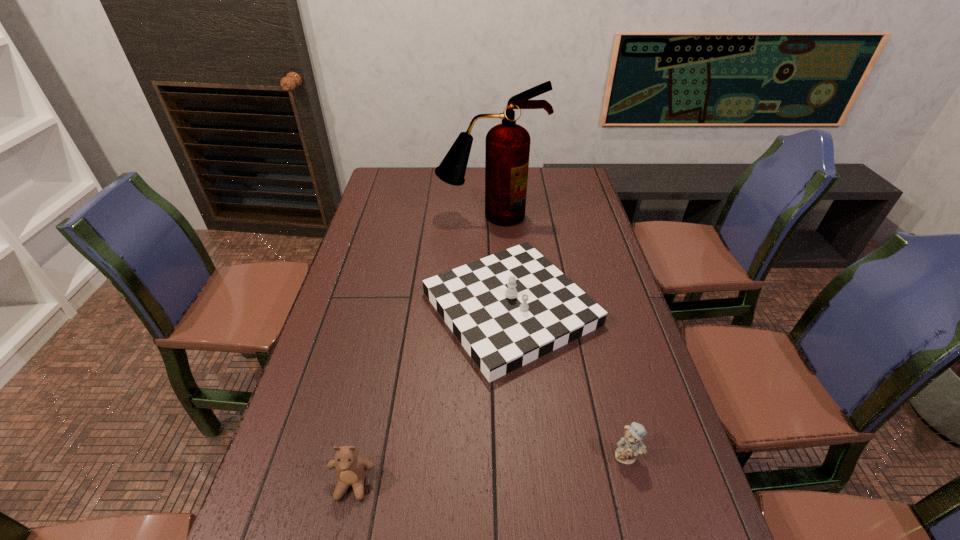
In order to click on the farthest object in this screenshot , I will do `click(507, 149)`.

Identify the location of the tallest object. (507, 149).

I want to click on checkerboard, so click(x=508, y=309).

Where is `the left teddy bear`? This screenshot has width=960, height=540. the left teddy bear is located at coordinates (351, 468).

Locate an element on the screen. the right teddy bear is located at coordinates (629, 446).

You are a GUI agent. You are given a task and a screenshot of the screen. Output one action in this format:
    pyautogui.click(x=<x>, y=<y>)
    Task: Click on the free space located at the nozzle of the tallest object
    This screenshot has height=540, width=960.
    Given the screenshot: What is the action you would take?
    pyautogui.click(x=491, y=245)

What are the coordinates of `vacant point located on the front of the checkerboard` in the screenshot? It's located at (517, 400).

Locate an element on the screen. vacant space situated 0.050m on the front-facing side of the left teddy bear is located at coordinates (343, 530).

Locate an element on the screen. This screenshot has width=960, height=540. free region located 0.110m on the front-facing side of the right teddy bear is located at coordinates (644, 522).

I want to click on object located in the left edge section of the desktop, so click(351, 468).